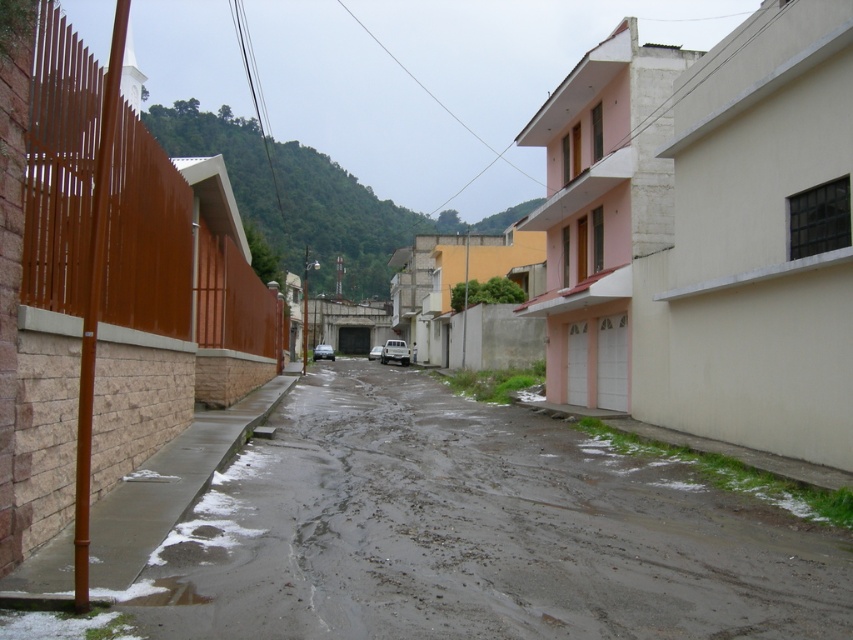
Between gray concrete mud at center and white matte car at center, which one is positioned higher?

white matte car at center is higher up.

Between gray concrete mud at center and white matte car at center, which one has more height?

white matte car at center is taller.

Is point (630, 566) more distant than point (376, 352)?

No, (630, 566) is closer to viewer.

Where is `gray concrete mud at center`? gray concrete mud at center is located at coordinates (476, 532).

Based on the photo, who is taller, gray concrete mud at center or white matte van at center?

Standing taller between the two is white matte van at center.

Does gray concrete mud at center have a greater height compared to white matte van at center?

In fact, gray concrete mud at center may be shorter than white matte van at center.

The width and height of the screenshot is (853, 640). Describe the element at coordinates (476, 532) in the screenshot. I see `gray concrete mud at center` at that location.

At what (x,y) coordinates should I click in order to perform the action: click on gray concrete mud at center. Please return your answer as a coordinate pair (x, y). The height and width of the screenshot is (640, 853). Looking at the image, I should click on (476, 532).

Does green leafy hillside at upper center appear on the left side of white matte van at center?

Indeed, green leafy hillside at upper center is positioned on the left side of white matte van at center.

Does point (254, 161) lie behind point (395, 349)?

Yes, it is behind point (395, 349).

This screenshot has height=640, width=853. Find the location of `green leafy hillside at upper center`. green leafy hillside at upper center is located at coordinates (300, 196).